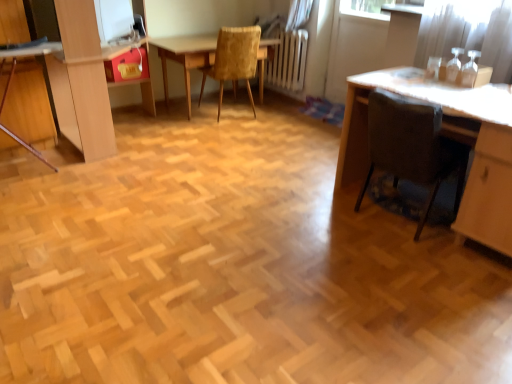
Identify the location of free area in between wooden table at center and velvet yellow chair at center, placed as the 1th chair when sorted from top to bottom. (253, 109).